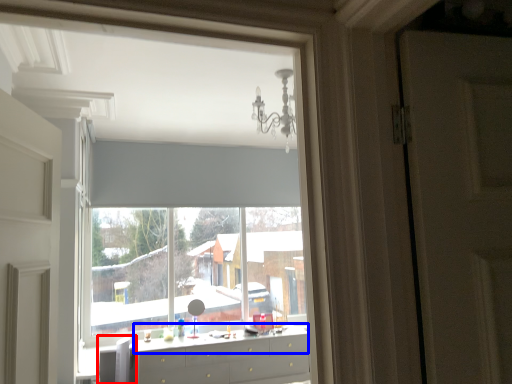
Question: Which point is further to the camera, swivel chair (highlighted by a red box) or counter top (highlighted by a blue box)?

Choices:
 (A) swivel chair
 (B) counter top

Answer: (B)